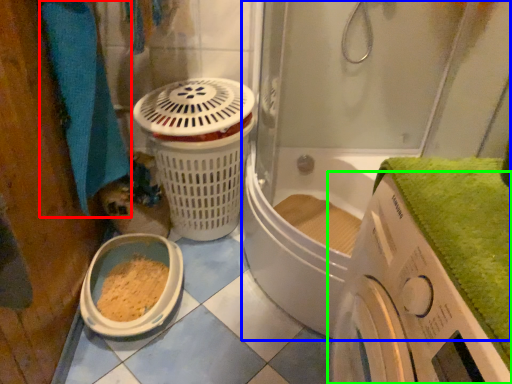
Question: Which is farther away from bath towel (highlighted by a red box)? shower door (highlighted by a blue box) or washing machine (highlighted by a green box)?

Choices:
 (A) shower door
 (B) washing machine

Answer: (B)